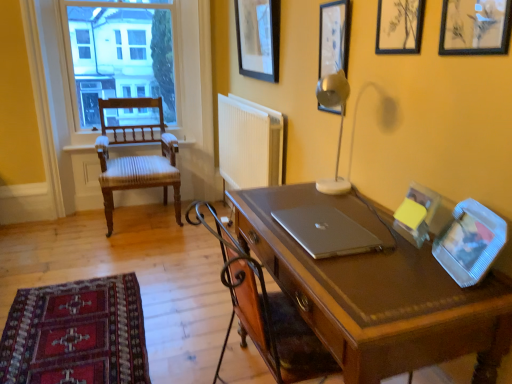
Where is `vacant space in front of silver metallic laptop at center`? The width and height of the screenshot is (512, 384). vacant space in front of silver metallic laptop at center is located at coordinates (358, 267).